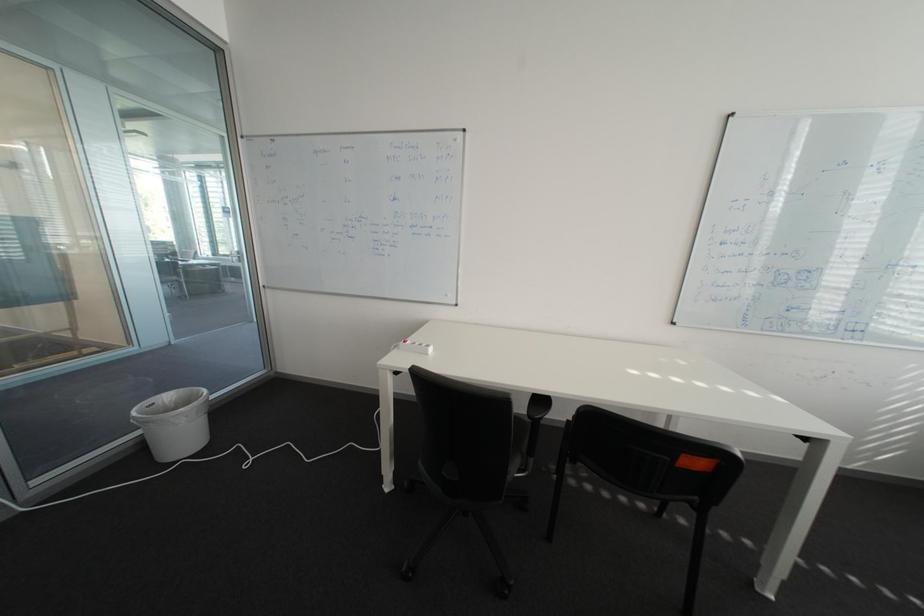
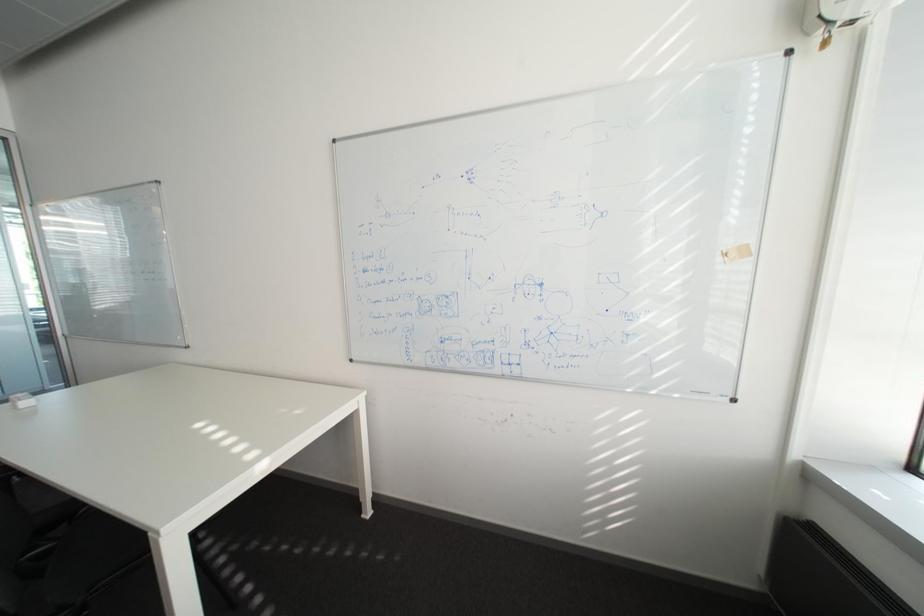
Question: The images are taken continuously from a first-person perspective. In which direction are you moving?

Choices:
 (A) Left
 (B) Right
 (C) Forward
 (D) Backward

Answer: (B)